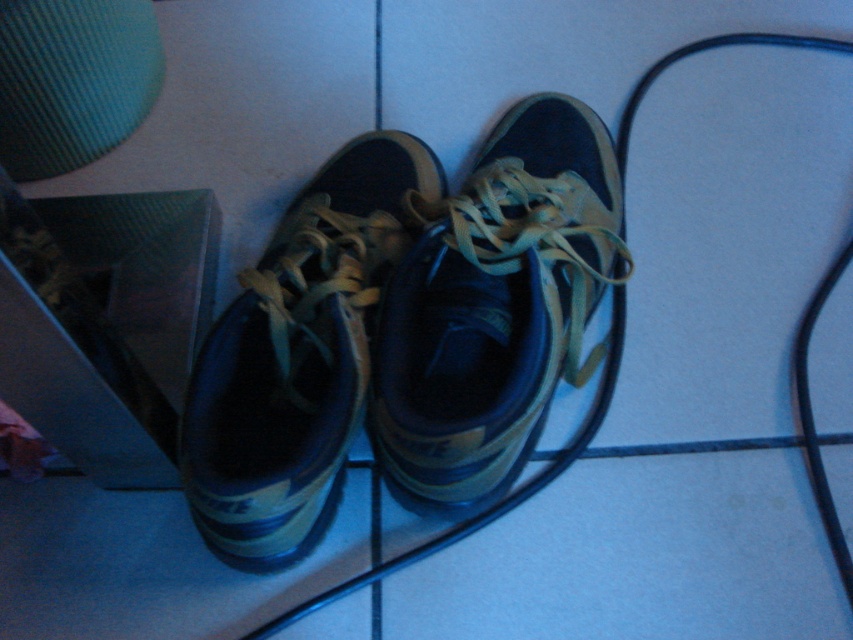
Question: Can you confirm if matte black sneaker at center is positioned to the left of matte blue sneaker at center?

Choices:
 (A) no
 (B) yes

Answer: (A)

Question: Considering the relative positions of matte black sneaker at center and matte blue sneaker at center in the image provided, where is matte black sneaker at center located with respect to matte blue sneaker at center?

Choices:
 (A) right
 (B) left

Answer: (A)

Question: Does matte black sneaker at center come behind matte blue sneaker at center?

Choices:
 (A) yes
 (B) no

Answer: (A)

Question: Which object appears closest to the camera in this image?

Choices:
 (A) matte blue sneaker at center
 (B) matte black sneaker at center

Answer: (A)

Question: Which of the following is the closest to the observer?

Choices:
 (A) matte black sneaker at center
 (B) matte blue sneaker at center

Answer: (B)